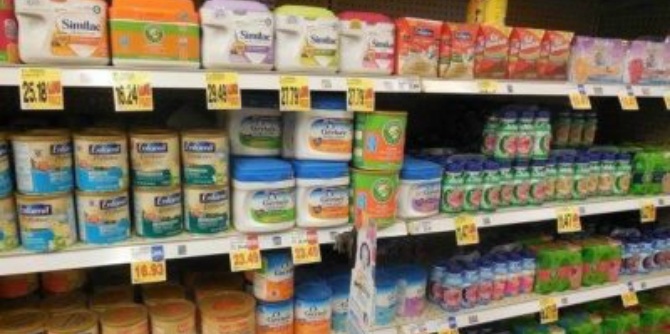
Find the location of a particular element. shelf is located at coordinates (419, 232).